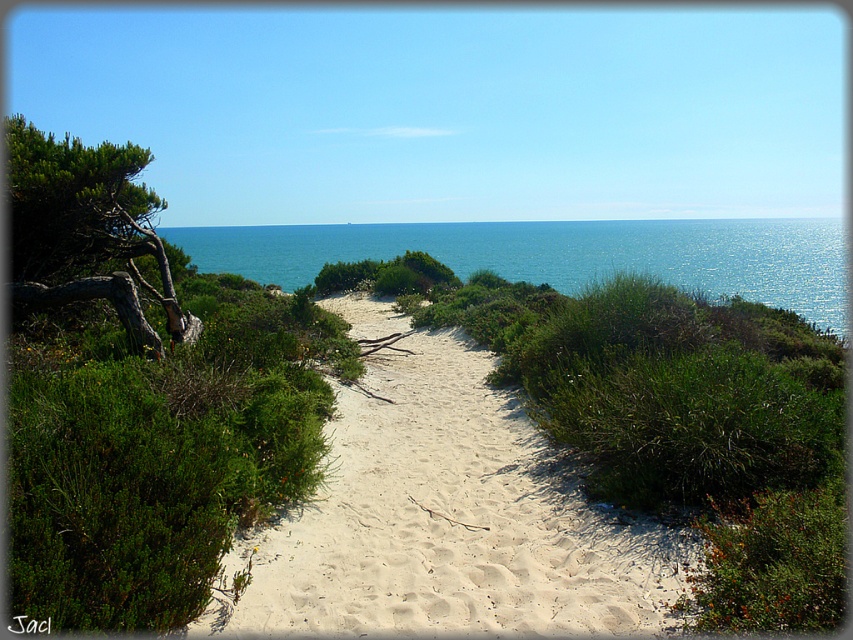
Question: Which object is the farthest from the blue water at upper center?

Choices:
 (A) green rough bark tree at left
 (B) white sandy path at center

Answer: (A)

Question: Estimate the real-world distances between objects in this image. Which object is closer to the white sandy path at center?

Choices:
 (A) green rough bark tree at left
 (B) blue water at upper center

Answer: (A)

Question: Which point is closer to the camera?

Choices:
 (A) (206, 227)
 (B) (369, 616)
 (C) (155, 259)

Answer: (B)

Question: Does white sandy path at center appear over green rough bark tree at left?

Choices:
 (A) no
 (B) yes

Answer: (A)

Question: Is blue water at upper center to the right of green rough bark tree at left from the viewer's perspective?

Choices:
 (A) no
 (B) yes

Answer: (B)

Question: In this image, where is white sandy path at center located relative to green rough bark tree at left?

Choices:
 (A) right
 (B) left

Answer: (A)